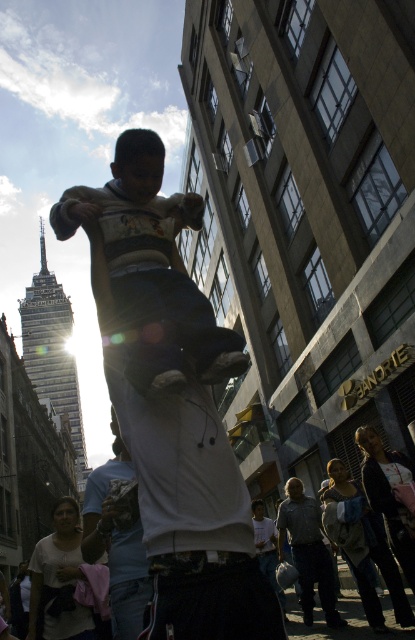
Question: Which object is farther from the camera taking this photo?

Choices:
 (A) matte white shirt at center
 (B) white cotton shirt at center
 (C) white fabric at lower left
 (D) gray textured shirt at center

Answer: (D)

Question: Is matte white shirt at center positioned at the back of white cotton shirt at center?

Choices:
 (A) yes
 (B) no

Answer: (B)

Question: Which point appears closest to the camera in this image?

Choices:
 (A) (31, 556)
 (B) (102, 515)
 (C) (305, 586)

Answer: (B)

Question: Can you confirm if matte white shirt at center is positioned to the left of gray textured shirt at center?

Choices:
 (A) yes
 (B) no

Answer: (A)

Question: Which of the following is the closest to the observer?

Choices:
 (A) (156, 180)
 (B) (100, 480)
 (C) (65, 636)

Answer: (A)

Question: Can you confirm if matte white shirt at center is positioned to the right of gray textured shirt at center?

Choices:
 (A) no
 (B) yes

Answer: (A)